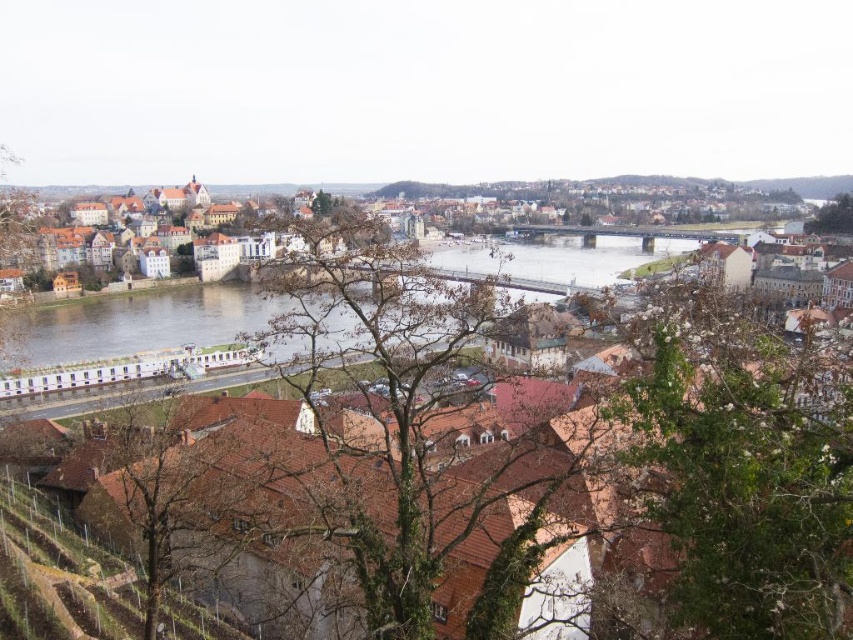
Does green leafy tree at lower right have a lesser width compared to brown tiled roofs at center?

Indeed, green leafy tree at lower right has a lesser width compared to brown tiled roofs at center.

Between green leafy tree at lower right and brown tiled roofs at center, which one has less height?

With less height is green leafy tree at lower right.

The width and height of the screenshot is (853, 640). Find the location of `green leafy tree at lower right`. green leafy tree at lower right is located at coordinates (741, 468).

Locate an element on the screen. Image resolution: width=853 pixels, height=640 pixels. green leafy tree at lower right is located at coordinates (741, 468).

Can you confirm if green leafy tree at lower right is bigger than green leafy tree at upper right?

No.

Identify the location of green leafy tree at lower right. (741, 468).

The image size is (853, 640). I want to click on green leafy tree at lower right, so click(741, 468).

Is brown tiled roofs at center thinner than green leafy tree at upper right?

No.

Does brown tiled roofs at center have a lesser height compared to green leafy tree at upper right?

In fact, brown tiled roofs at center may be taller than green leafy tree at upper right.

You are a GUI agent. You are given a task and a screenshot of the screen. Output one action in this format:
    pyautogui.click(x=<x>, y=<y>)
    Task: Click on the brown tiled roofs at center
    
    Given the screenshot: What is the action you would take?
    pyautogui.click(x=659, y=230)

The height and width of the screenshot is (640, 853). Identify the location of brown tiled roofs at center. (659, 230).